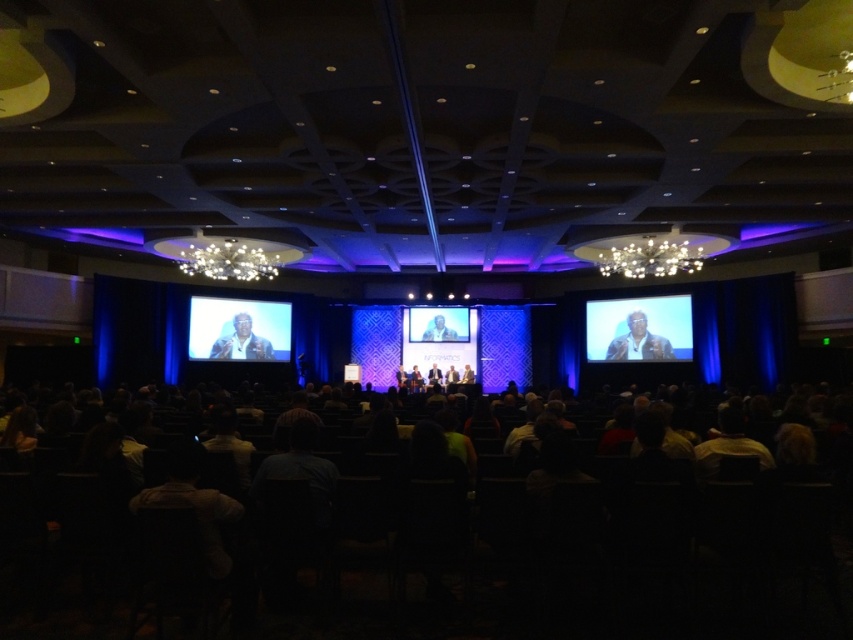
How much distance is there between matte black screen at right and matte black jacket at center?

matte black screen at right is 11.25 meters away from matte black jacket at center.

Which is more to the left, matte black screen at right or matte black jacket at center?

matte black jacket at center is more to the left.

Locate an element on the screen. This screenshot has height=640, width=853. matte black screen at right is located at coordinates (639, 328).

Can you confirm if matte black screen at right is wider than matte black panel at center?

Incorrect, matte black screen at right's width does not surpass matte black panel at center's.

Is matte black screen at right bigger than matte black panel at center?

Correct, matte black screen at right is larger in size than matte black panel at center.

Is point (654, 300) positioned behind point (456, 356)?

No, (654, 300) is in front of (456, 356).

At what (x,y) coordinates should I click in order to perform the action: click on matte black screen at right. Please return your answer as a coordinate pair (x, y). This screenshot has height=640, width=853. Looking at the image, I should click on (639, 328).

Can you confirm if matte black screen at center is positioned above matte black panel at center?

Indeed, matte black screen at center is positioned over matte black panel at center.

Who is more forward, (x=289, y=324) or (x=469, y=356)?

Positioned in front is point (x=289, y=324).

In order to click on matte black screen at center in this screenshot , I will do `click(238, 330)`.

What are the coordinates of `matte black screen at center` in the screenshot? It's located at (238, 330).